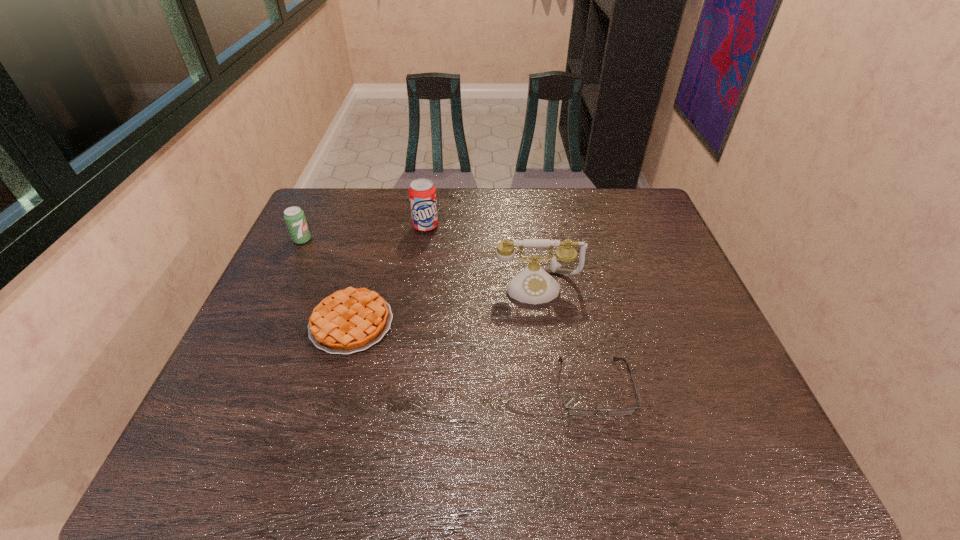
Identify the location of telephone. Image resolution: width=960 pixels, height=540 pixels. (533, 285).

Where is `the farthest object`? Image resolution: width=960 pixels, height=540 pixels. the farthest object is located at coordinates (422, 193).

Find the location of a particular element. This screenshot has height=540, width=960. the farther soda is located at coordinates (422, 193).

Where is `the leftmost object`? the leftmost object is located at coordinates (295, 219).

In order to click on the second farthest object in this screenshot , I will do 295,219.

This screenshot has width=960, height=540. In order to click on the second object from left to right in this screenshot , I will do `click(351, 320)`.

Where is `the nearest object`? This screenshot has height=540, width=960. the nearest object is located at coordinates (573, 411).

You are a GUI agent. You are given a task and a screenshot of the screen. Output one action in this format:
    pyautogui.click(x=<x>, y=<y>)
    Task: Click on the free spot located on the dial of the telephone
    This screenshot has height=540, width=960.
    Given the screenshot: What is the action you would take?
    pyautogui.click(x=544, y=334)

Locate an element on the screen. vacant point located on the surface of the farther soda is located at coordinates (416, 292).

This screenshot has width=960, height=540. I want to click on vacant space located 0.150m on the front of the shorter soda, so coord(283,279).